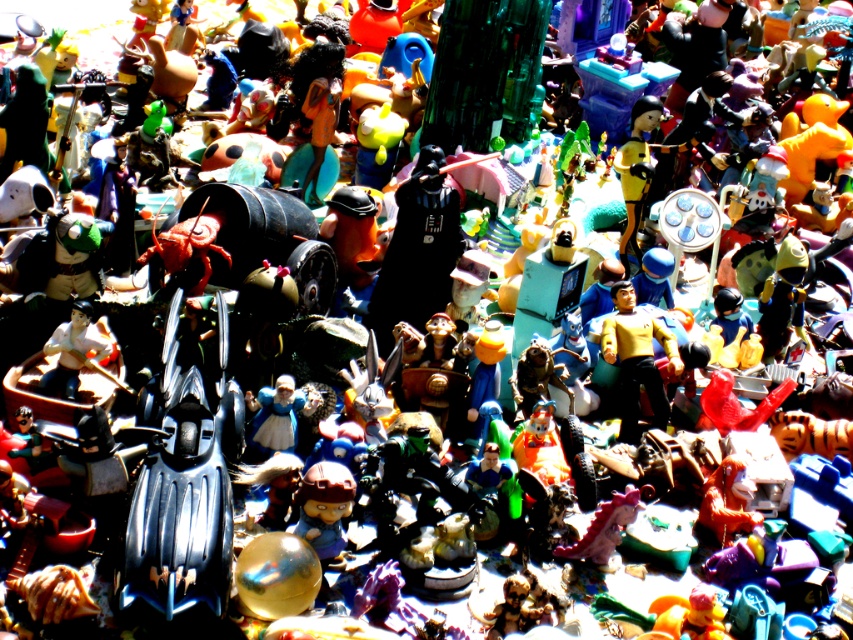
Question: Can you confirm if yellow matte starship at center is positioned below matte brown figurine at center?

Choices:
 (A) yes
 (B) no

Answer: (B)

Question: Which point is closer to the camera?

Choices:
 (A) (305, 522)
 (B) (650, 321)

Answer: (A)

Question: Which object is farther from the camera taking this photo?

Choices:
 (A) matte brown figurine at center
 (B) yellow matte starship at center

Answer: (B)

Question: Is yellow matte starship at center to the right of matte brown figurine at center from the viewer's perspective?

Choices:
 (A) no
 (B) yes

Answer: (B)

Question: Is yellow matte starship at center smaller than matte brown figurine at center?

Choices:
 (A) no
 (B) yes

Answer: (A)